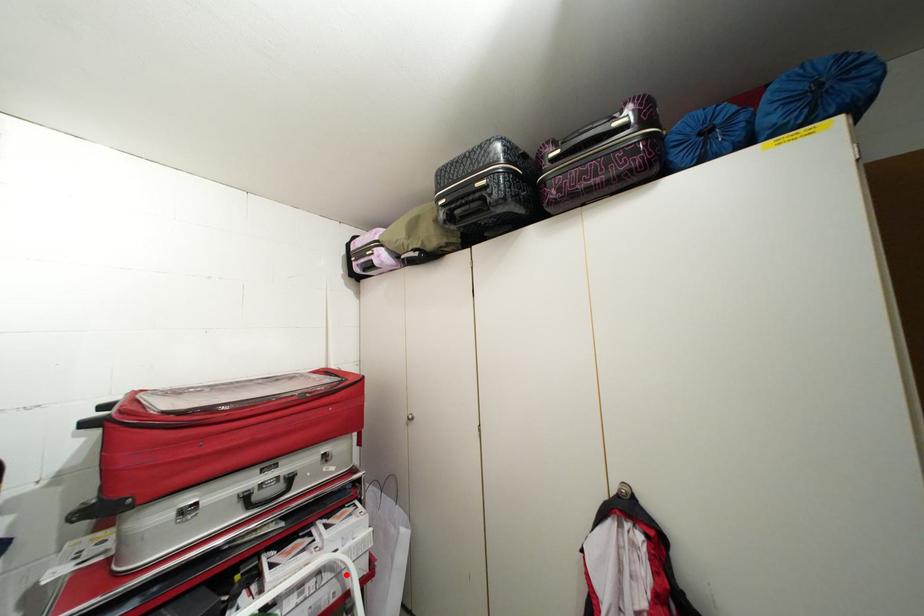
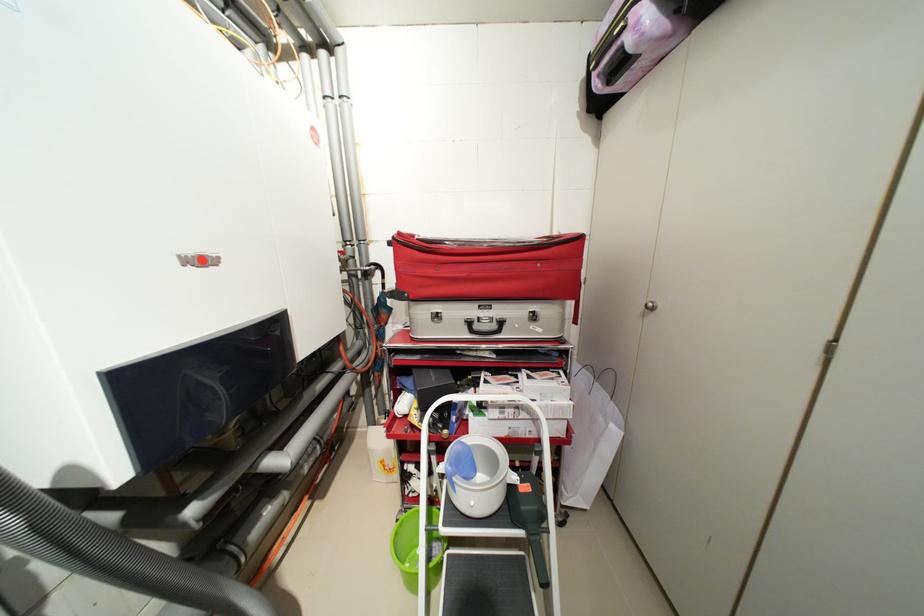
Find the pixel in the second image that matches the highlighted location in the first image.

(541, 421)